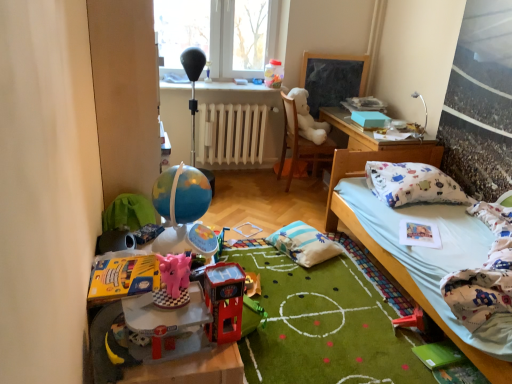
Question: Could you tell me if pink plastic piggy bank at lower left, acting as the second toy starting from the bottom, is facing pink plastic piggy bank at center, which is the second toy from top to bottom?

Choices:
 (A) no
 (B) yes

Answer: (A)

Question: Does pink plastic piggy bank at lower left, the first toy positioned from the front, come behind pink plastic piggy bank at center, acting as the 2th toy starting from the left?

Choices:
 (A) yes
 (B) no

Answer: (B)

Question: Considering the relative sizes of pink plastic piggy bank at lower left, acting as the second toy starting from the bottom, and pink plastic piggy bank at center, the fourth toy ordered from the bottom, in the image provided, is pink plastic piggy bank at lower left, acting as the second toy starting from the bottom, shorter than pink plastic piggy bank at center, the fourth toy ordered from the bottom,?

Choices:
 (A) yes
 (B) no

Answer: (B)

Question: From the image's perspective, does pink plastic piggy bank at lower left, the first toy positioned from the front, appear lower than pink plastic piggy bank at center, acting as the 2th toy starting from the left?

Choices:
 (A) yes
 (B) no

Answer: (A)

Question: Is pink plastic piggy bank at lower left, which ranks as the 4th toy in top-to-bottom order, surrounding pink plastic piggy bank at center, which is the second toy from top to bottom?

Choices:
 (A) yes
 (B) no

Answer: (B)

Question: From a real-world perspective, is light blue fabric bed at lower right above or below transparent plastic window at upper center?

Choices:
 (A) above
 (B) below

Answer: (B)

Question: From the image's perspective, is light blue fabric bed at lower right positioned above or below transparent plastic window at upper center?

Choices:
 (A) above
 (B) below

Answer: (B)

Question: Looking at the image, does light blue fabric bed at lower right seem bigger or smaller compared to transparent plastic window at upper center?

Choices:
 (A) big
 (B) small

Answer: (A)

Question: Considering the positions of point (359, 158) and point (250, 26), is point (359, 158) closer or farther from the camera than point (250, 26)?

Choices:
 (A) farther
 (B) closer

Answer: (B)

Question: Is pink plastic piggy bank at center, acting as the 2th toy starting from the left, in front of or behind light blue fabric bed at lower right in the image?

Choices:
 (A) front
 (B) behind

Answer: (A)

Question: Looking at the image, does pink plastic piggy bank at center, placed as the 2th toy when sorted from front to back, seem bigger or smaller compared to light blue fabric bed at lower right?

Choices:
 (A) small
 (B) big

Answer: (A)

Question: From their relative heights in the image, would you say pink plastic piggy bank at center, which is the second toy from top to bottom, is taller or shorter than light blue fabric bed at lower right?

Choices:
 (A) tall
 (B) short

Answer: (B)

Question: In terms of width, does pink plastic piggy bank at center, which is the second toy from top to bottom, look wider or thinner when compared to light blue fabric bed at lower right?

Choices:
 (A) thin
 (B) wide

Answer: (A)

Question: In terms of width, does white matte radiator at center look wider or thinner when compared to shiny plastic toy car at center, acting as the 3th toy starting from the front?

Choices:
 (A) thin
 (B) wide

Answer: (B)

Question: Is white matte radiator at center taller or shorter than shiny plastic toy car at center, which is counted as the third toy, starting from the top?

Choices:
 (A) short
 (B) tall

Answer: (B)